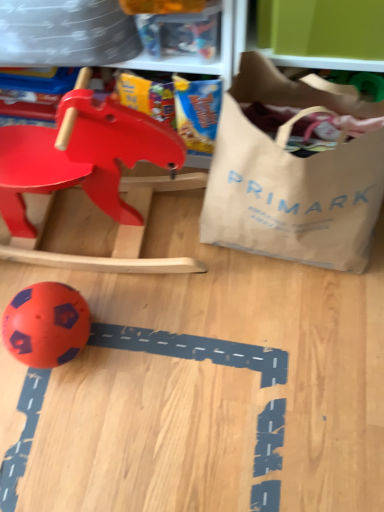
Question: From the image's perspective, would you say orange rubber ball at lower left, the 2th toy positioned from the top, is shown under brown paper bag at right?

Choices:
 (A) yes
 (B) no

Answer: (A)

Question: From the image's perspective, is orange rubber ball at lower left, positioned as the first toy in bottom-to-top order, on top of brown paper bag at right?

Choices:
 (A) yes
 (B) no

Answer: (B)

Question: Is orange rubber ball at lower left, the 2th toy positioned from the top, located outside brown paper bag at right?

Choices:
 (A) yes
 (B) no

Answer: (A)

Question: Is orange rubber ball at lower left, the 2th toy positioned from the top, thinner than brown paper bag at right?

Choices:
 (A) no
 (B) yes

Answer: (B)

Question: Can you confirm if orange rubber ball at lower left, the 2th toy positioned from the top, is bigger than brown paper bag at right?

Choices:
 (A) no
 (B) yes

Answer: (A)

Question: Is orange rubber ball at lower left, the 2th toy positioned from the top, further to camera compared to brown paper bag at right?

Choices:
 (A) yes
 (B) no

Answer: (A)

Question: Is brown paper bag at right not within matte plastic rocking horse at upper left, the first toy when ordered from top to bottom?

Choices:
 (A) no
 (B) yes

Answer: (B)

Question: From the image's perspective, is brown paper bag at right above matte plastic rocking horse at upper left, placed as the second toy when sorted from bottom to top?

Choices:
 (A) no
 (B) yes

Answer: (B)

Question: Is brown paper bag at right thinner than matte plastic rocking horse at upper left, the first toy when ordered from top to bottom?

Choices:
 (A) yes
 (B) no

Answer: (B)

Question: Can you see brown paper bag at right touching matte plastic rocking horse at upper left, the first toy when ordered from top to bottom?

Choices:
 (A) yes
 (B) no

Answer: (B)

Question: From a real-world perspective, is brown paper bag at right beneath matte plastic rocking horse at upper left, placed as the second toy when sorted from bottom to top?

Choices:
 (A) no
 (B) yes

Answer: (A)

Question: Is brown paper bag at right not near matte plastic rocking horse at upper left, the first toy when ordered from top to bottom?

Choices:
 (A) no
 (B) yes

Answer: (A)

Question: Is the depth of matte plastic rocking horse at upper left, placed as the second toy when sorted from bottom to top, less than that of brown paper bag at right?

Choices:
 (A) no
 (B) yes

Answer: (A)